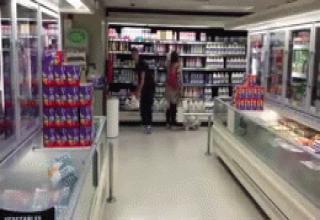
Identify the location of counter. pyautogui.click(x=61, y=175), pyautogui.click(x=272, y=138).